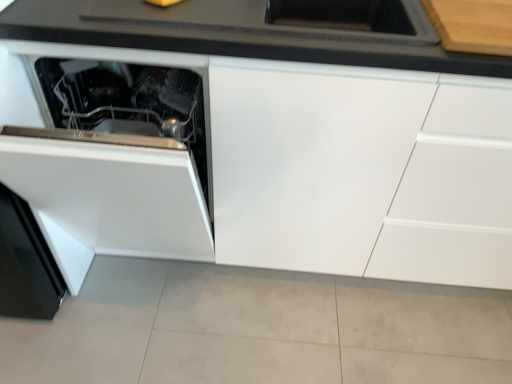
Question: Can you confirm if white glossy oven at lower left is positioned to the right of black matte countertop at upper center?

Choices:
 (A) no
 (B) yes

Answer: (A)

Question: From a real-world perspective, is white glossy oven at lower left located higher than black matte countertop at upper center?

Choices:
 (A) no
 (B) yes

Answer: (A)

Question: Is white glossy oven at lower left closer to camera compared to black matte countertop at upper center?

Choices:
 (A) no
 (B) yes

Answer: (B)

Question: Can you confirm if white glossy oven at lower left is wider than black matte countertop at upper center?

Choices:
 (A) no
 (B) yes

Answer: (B)

Question: Could you tell me if white glossy oven at lower left is turned towards black matte countertop at upper center?

Choices:
 (A) yes
 (B) no

Answer: (B)

Question: Is white glossy oven at lower left beside black matte countertop at upper center?

Choices:
 (A) yes
 (B) no

Answer: (B)

Question: Can you confirm if white glossy cabinet at center is wider than black matte countertop at upper center?

Choices:
 (A) yes
 (B) no

Answer: (A)

Question: From a real-world perspective, is white glossy cabinet at center over black matte countertop at upper center?

Choices:
 (A) yes
 (B) no

Answer: (B)

Question: From a real-world perspective, is white glossy cabinet at center positioned under black matte countertop at upper center based on gravity?

Choices:
 (A) no
 (B) yes

Answer: (B)

Question: From the image's perspective, is white glossy cabinet at center above black matte countertop at upper center?

Choices:
 (A) yes
 (B) no

Answer: (B)

Question: Is white glossy cabinet at center oriented towards black matte countertop at upper center?

Choices:
 (A) yes
 (B) no

Answer: (B)

Question: Is white glossy cabinet at center directly adjacent to black matte countertop at upper center?

Choices:
 (A) yes
 (B) no

Answer: (B)

Question: Can you confirm if white glossy cabinet at center is wider than white glossy oven at lower left?

Choices:
 (A) yes
 (B) no

Answer: (B)